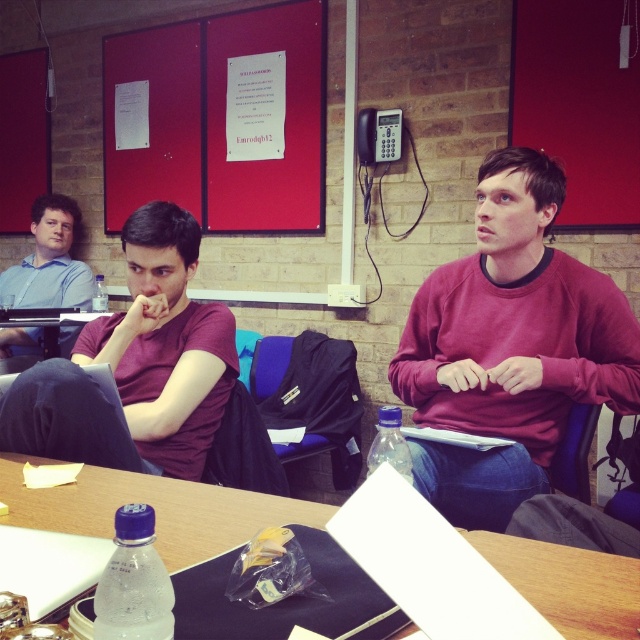
You are a new employee in the office and need to locate the red matte board at upper left and the matte blue shirt at left. Which object is taller?

The red matte board at upper left is taller than the matte blue shirt at left.

You are standing in the meeting room and need to locate the red matte board at upper left. According to the coordinates given, where exactly is it positioned?

The red matte board at upper left is positioned at the 2D coordinates point (x=220, y=120).